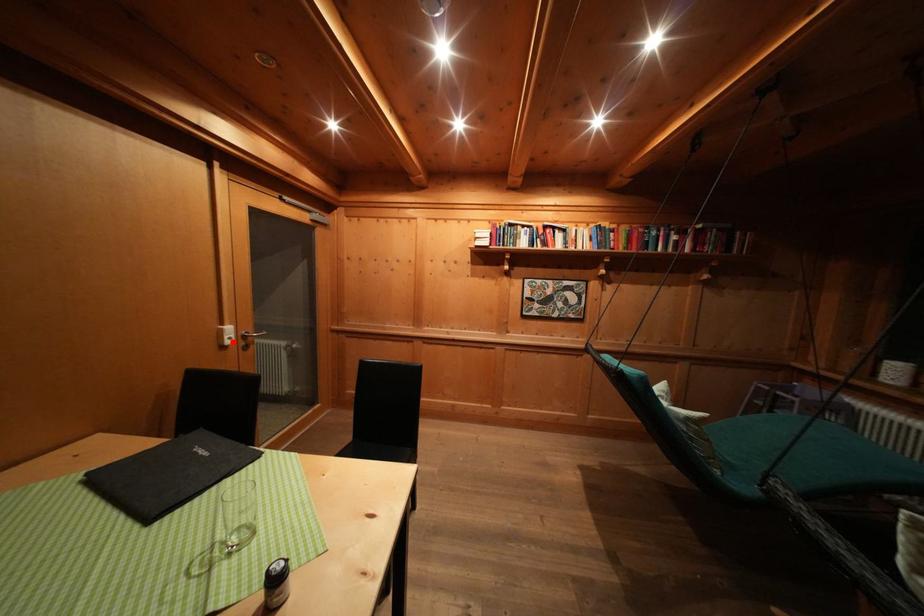
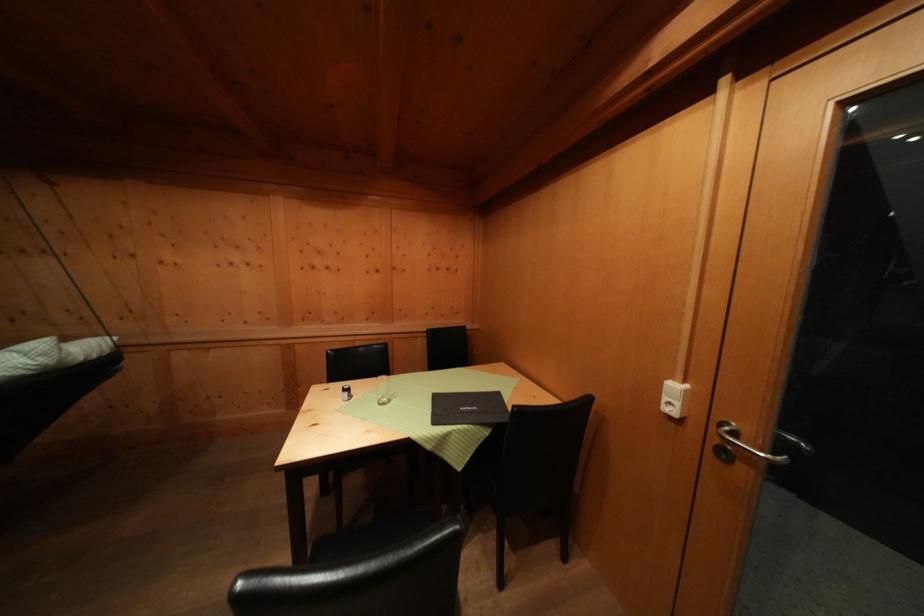
In the second image, find the point that corresponds to the highlighted location in the first image.

(672, 403)